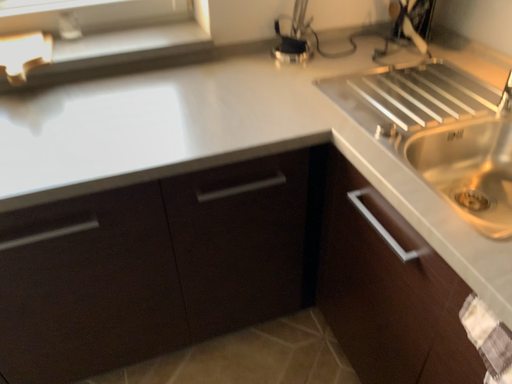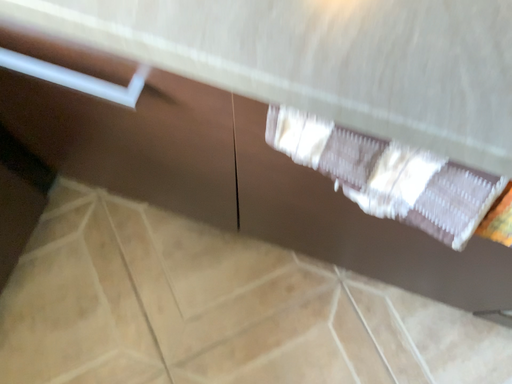
Question: How did the camera likely rotate when shooting the video?

Choices:
 (A) rotated downward
 (B) rotated upward

Answer: (A)